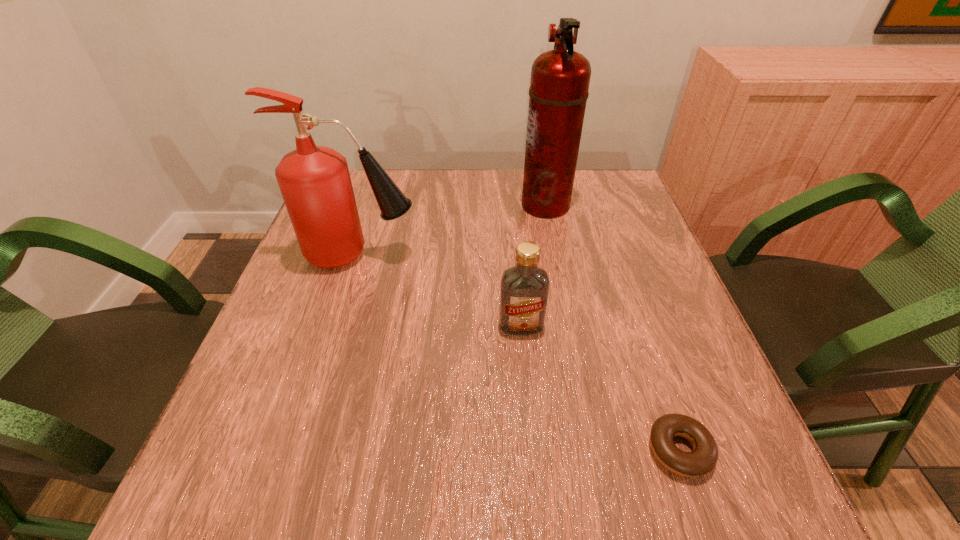
Identify the location of the farther fire extinguisher. The width and height of the screenshot is (960, 540). (560, 78).

Find the location of a particular element. the tallest object is located at coordinates (560, 78).

At what (x,y) coordinates should I click in order to perform the action: click on the nearer fire extinguisher. Please return your answer as a coordinate pair (x, y). The height and width of the screenshot is (540, 960). Looking at the image, I should click on (315, 183).

Locate an element on the screen. The width and height of the screenshot is (960, 540). the third shortest object is located at coordinates (315, 183).

You are a GUI agent. You are given a task and a screenshot of the screen. Output one action in this format:
    pyautogui.click(x=<x>, y=<y>)
    Task: Click on the second nearest object
    This screenshot has width=960, height=540.
    Given the screenshot: What is the action you would take?
    pyautogui.click(x=524, y=290)

At what (x,y) coordinates should I click in order to perform the action: click on vodka. Please return your answer as a coordinate pair (x, y). Looking at the image, I should click on (524, 290).

At what (x,y) coordinates should I click in order to perform the action: click on the rightmost object. Please return your answer as a coordinate pair (x, y). The width and height of the screenshot is (960, 540). Looking at the image, I should click on (703, 458).

Where is `the shortest object`? the shortest object is located at coordinates (703, 458).

Where is `vacant region located on the nozzle side of the right fire extinguisher`? The image size is (960, 540). vacant region located on the nozzle side of the right fire extinguisher is located at coordinates (462, 205).

What are the coordinates of `free region located on the nozzle side of the right fire extinguisher` in the screenshot? It's located at tap(488, 205).